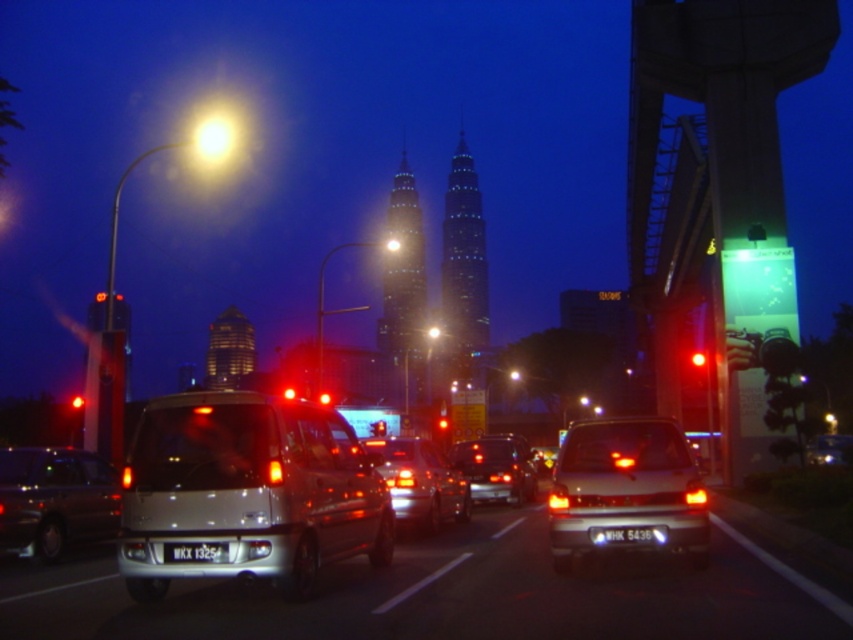
Question: Which object is farther from the camera taking this photo?

Choices:
 (A) black plastic license plate at center
 (B) shiny silver sedan at center

Answer: (B)

Question: Which point is closer to the camera?

Choices:
 (A) (619, 531)
 (B) (697, 355)

Answer: (A)

Question: Is metallic silver sedan at center below bright yellow glass streetlight at upper left?

Choices:
 (A) no
 (B) yes

Answer: (B)

Question: Is black plastic license plate at center smaller than bright yellow streetlight at upper center?

Choices:
 (A) yes
 (B) no

Answer: (A)

Question: Is metallic silver sedan at center thinner than bright yellow streetlight at upper center?

Choices:
 (A) yes
 (B) no

Answer: (A)

Question: Which point is closer to the camera?

Choices:
 (A) black plastic license plate at center
 (B) white plastic license plate at center
 (C) silver metallic van at center
 (D) shiny silver sedan at center

Answer: (C)